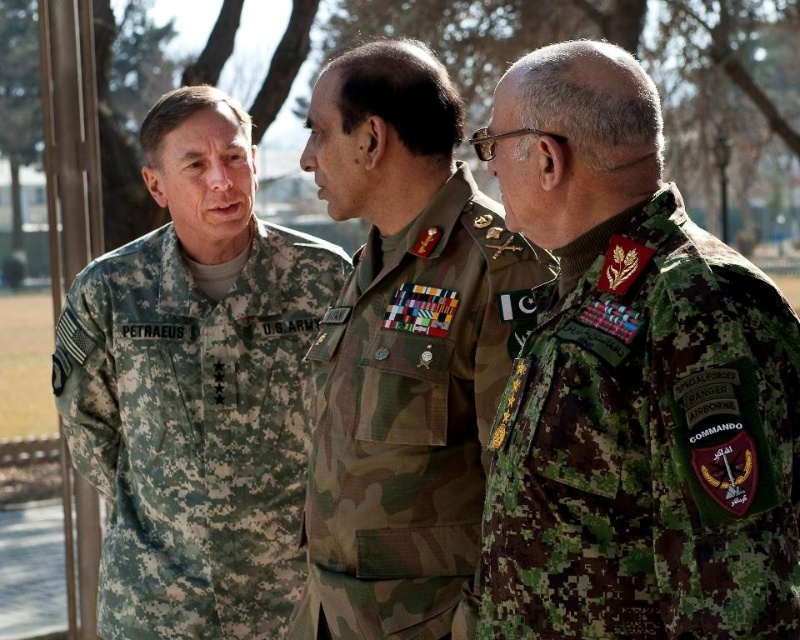
Question: Which object is positioned farthest from the camouflage fabric military uniform at center?

Choices:
 (A) digital camouflage uniform at right
 (B) camouflage fabric uniform at left

Answer: (B)

Question: Estimate the real-world distances between objects in this image. Which object is farther from the camouflage fabric military uniform at center?

Choices:
 (A) digital camouflage uniform at right
 (B) camouflage fabric uniform at left

Answer: (B)

Question: Is digital camouflage uniform at right to the left of camouflage fabric military uniform at center from the viewer's perspective?

Choices:
 (A) no
 (B) yes

Answer: (A)

Question: Can you confirm if digital camouflage uniform at right is thinner than camouflage fabric military uniform at center?

Choices:
 (A) no
 (B) yes

Answer: (B)

Question: Does camouflage fabric uniform at left appear under camouflage fabric military uniform at center?

Choices:
 (A) yes
 (B) no

Answer: (A)

Question: Which point appears farthest from the camera in this image?

Choices:
 (A) (225, 467)
 (B) (384, 566)
 (C) (562, 497)

Answer: (A)